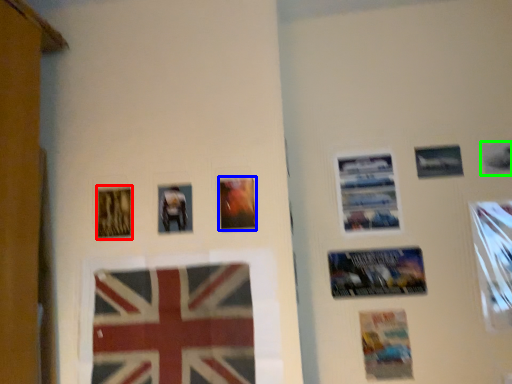
Question: Considering the real-world distances, which object is closest to picture frame (highlighted by a red box)? picture frame (highlighted by a blue box) or picture frame (highlighted by a green box).

Choices:
 (A) picture frame
 (B) picture frame

Answer: (A)